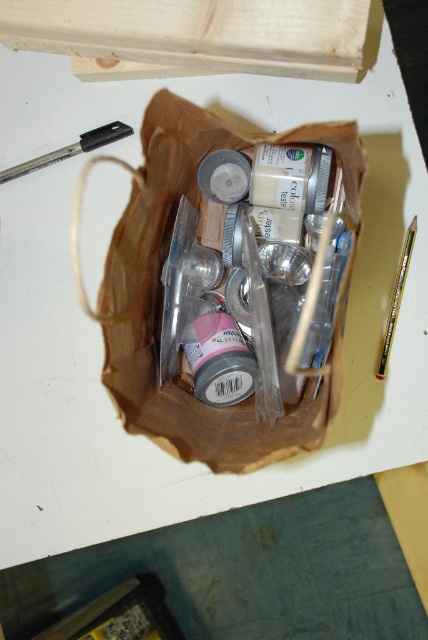
Question: Is brown paper bag at center closer to the viewer compared to metallic pen at upper left?

Choices:
 (A) no
 (B) yes

Answer: (B)

Question: Estimate the real-world distances between objects in this image. Which object is closer to the brown paper bag at center?

Choices:
 (A) matte pink plastic bottle at center
 (B) metallic pen at upper left

Answer: (A)

Question: Is brown paper bag at center above matte pink plastic bottle at center?

Choices:
 (A) yes
 (B) no

Answer: (A)

Question: Is brown paper bag at center positioned before metallic silver paint brush at right?

Choices:
 (A) yes
 (B) no

Answer: (A)

Question: Which object is positioned farthest from the metallic pen at upper left?

Choices:
 (A) matte pink plastic bottle at center
 (B) brown paper bag at center
 (C) metallic silver paint brush at right

Answer: (C)

Question: Considering the real-world distances, which object is closest to the metallic pen at upper left?

Choices:
 (A) matte pink plastic bottle at center
 (B) metallic silver paint brush at right

Answer: (A)